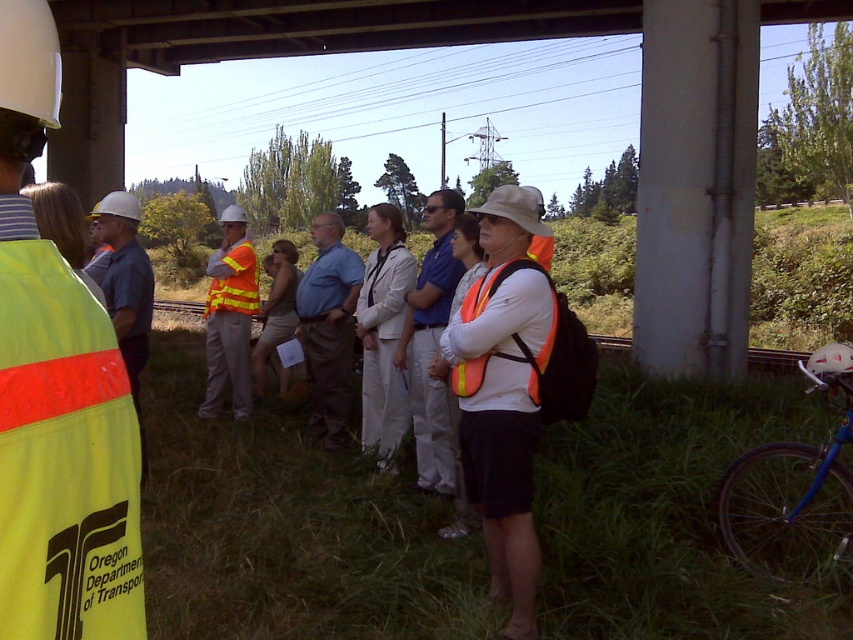
You are standing at the origin point of the image. Where is the orange reflective vest at center located in terms of coordinates?

The orange reflective vest at center is located at coordinates point (502, 396).

You are a pedestrian trying to cross the bridge. You see the brushed metal overpass at upper center and the matte orange vest at center. Which object is closer to the left side of the bridge?

The brushed metal overpass at upper center is closer to the left side of the bridge because it is positioned to the left of the matte orange vest at center.

You are planning to install a new safety sign on the structure. Given the dimensions provided, which object between the brushed metal overpass at upper center and the matte orange vest at center would require a larger sign to cover its width?

The brushed metal overpass at upper center requires a larger sign because its width is greater than the matte orange vest at center.